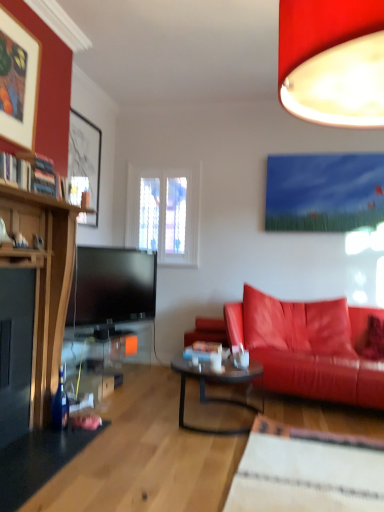
Question: From a real-world perspective, is matte black picture frame at upper left, which is counted as the first picture frame, starting from the back, over translucent glass coffee table at center?

Choices:
 (A) no
 (B) yes

Answer: (B)

Question: Is matte black picture frame at upper left, which is counted as the first picture frame, starting from the back, positioned before translucent glass coffee table at center?

Choices:
 (A) no
 (B) yes

Answer: (A)

Question: Is matte black picture frame at upper left, marked as the second picture frame in a front-to-back arrangement, to the left of translucent glass coffee table at center from the viewer's perspective?

Choices:
 (A) no
 (B) yes

Answer: (B)

Question: From the image's perspective, is matte black picture frame at upper left, marked as the second picture frame in a front-to-back arrangement, above translucent glass coffee table at center?

Choices:
 (A) yes
 (B) no

Answer: (A)

Question: Could you tell me if matte black picture frame at upper left, marked as the second picture frame in a front-to-back arrangement, is facing translucent glass coffee table at center?

Choices:
 (A) no
 (B) yes

Answer: (A)

Question: From a real-world perspective, relative to wooden picture frame at upper left, the 1th picture frame when ordered from front to back, is hardcover books at upper left vertically above or below?

Choices:
 (A) above
 (B) below

Answer: (B)

Question: Is point [9, 158] closer or farther from the camera than point [1, 134]?

Choices:
 (A) farther
 (B) closer

Answer: (B)

Question: Is hardcover books at upper left wider or thinner than wooden picture frame at upper left, the 1th picture frame when ordered from front to back?

Choices:
 (A) wide
 (B) thin

Answer: (A)

Question: Considering the positions of hardcover books at upper left and wooden picture frame at upper left, which appears as the second picture frame when viewed from the back, in the image, is hardcover books at upper left taller or shorter than wooden picture frame at upper left, which appears as the second picture frame when viewed from the back,?

Choices:
 (A) short
 (B) tall

Answer: (A)

Question: From the image's perspective, is translucent glass coffee table at center above or below shiny leather couch at right?

Choices:
 (A) below
 (B) above

Answer: (A)

Question: Considering the positions of translucent glass coffee table at center and shiny leather couch at right in the image, is translucent glass coffee table at center bigger or smaller than shiny leather couch at right?

Choices:
 (A) small
 (B) big

Answer: (A)

Question: Which is correct: translucent glass coffee table at center is inside shiny leather couch at right, or outside of it?

Choices:
 (A) inside
 (B) outside

Answer: (B)

Question: Is point (218, 396) closer or farther from the camera than point (284, 384)?

Choices:
 (A) farther
 (B) closer

Answer: (A)

Question: From the image's perspective, is matte red lampshade at upper right positioned above or below translucent glass coffee table at center?

Choices:
 (A) above
 (B) below

Answer: (A)

Question: Is matte red lampshade at upper right to the left or to the right of translucent glass coffee table at center in the image?

Choices:
 (A) left
 (B) right

Answer: (B)